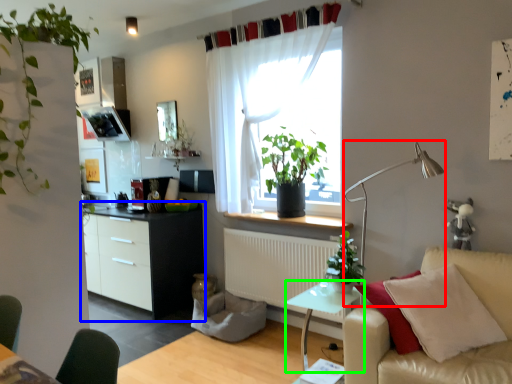
Question: Which object is positioned closest to table lamp (highlighted by a red box)? Select from cabinetry (highlighted by a blue box) and table (highlighted by a green box).

Choices:
 (A) cabinetry
 (B) table

Answer: (B)